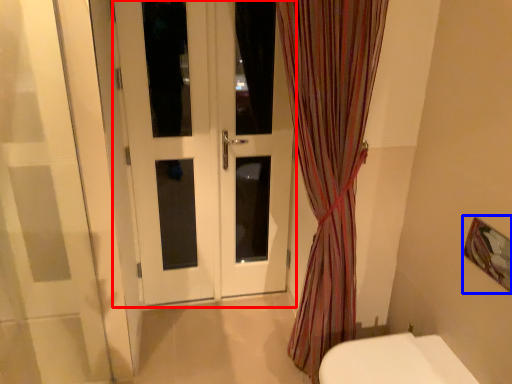
Question: Among these objects, which one is farthest to the camera, door (highlighted by a red box) or picture frame (highlighted by a blue box)?

Choices:
 (A) door
 (B) picture frame

Answer: (A)